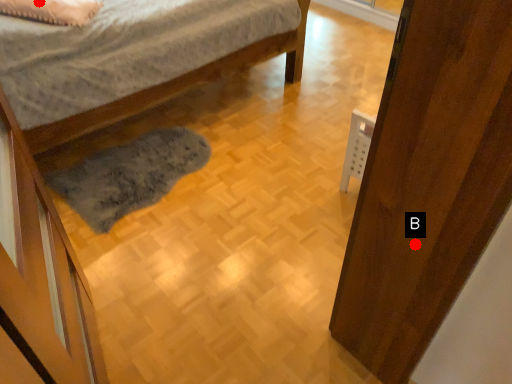
Question: Two points are circled on the image, labeled by A and B beside each circle. Which point is further to the camera?

Choices:
 (A) A is further
 (B) B is further

Answer: (A)